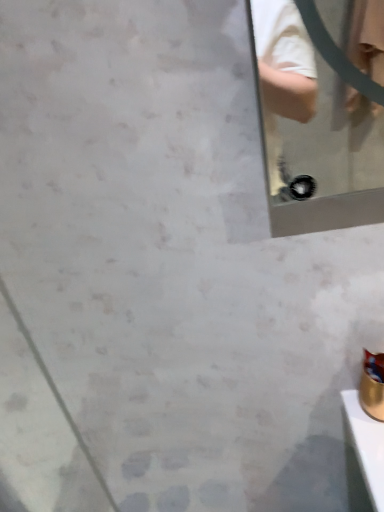
Measure the distance between gold metallic can at lower right and camera.

A distance of 30.72 inches exists between gold metallic can at lower right and camera.

Describe the element at coordinates (372, 385) in the screenshot. I see `gold metallic can at lower right` at that location.

Where is `gold metallic can at lower right`? The height and width of the screenshot is (512, 384). gold metallic can at lower right is located at coordinates (372, 385).

You are a GUI agent. You are given a task and a screenshot of the screen. Output one action in this format:
    pyautogui.click(x=<x>, y=<y>)
    Task: Click on the gold metallic can at lower right
    The height and width of the screenshot is (512, 384).
    Given the screenshot: What is the action you would take?
    pyautogui.click(x=372, y=385)